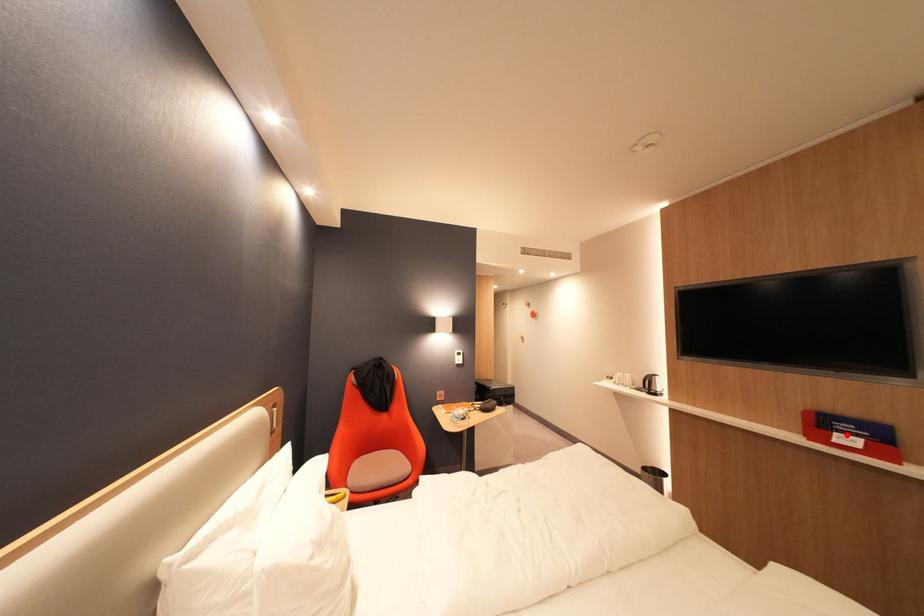
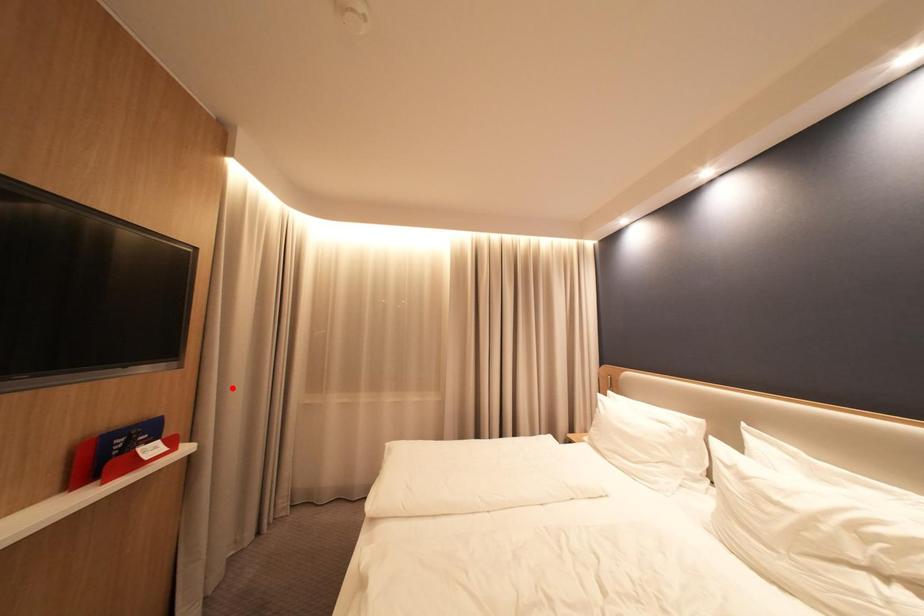
I am providing you with two images of the same scene from different viewpoints. A red point is marked on the first image and another point is marked on the second image. Is the marked point in image1 the same physical position as the marked point in image2?

No